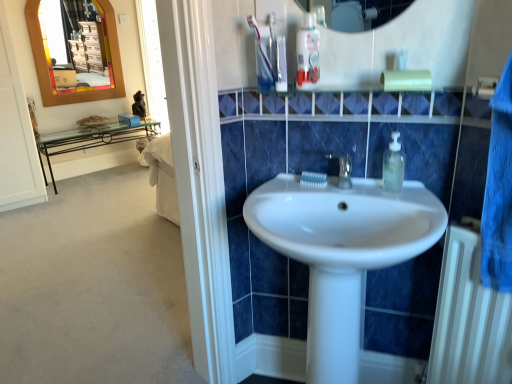
Question: From a real-world perspective, is clear plastic soap dispenser at upper right located beneath white glossy sink at center?

Choices:
 (A) yes
 (B) no

Answer: (B)

Question: Considering the relative sizes of clear plastic soap dispenser at upper right and white glossy sink at center in the image provided, is clear plastic soap dispenser at upper right taller than white glossy sink at center?

Choices:
 (A) no
 (B) yes

Answer: (A)

Question: Is clear plastic soap dispenser at upper right behind white glossy sink at center?

Choices:
 (A) yes
 (B) no

Answer: (A)

Question: Does clear plastic soap dispenser at upper right appear on the right side of white glossy sink at center?

Choices:
 (A) no
 (B) yes

Answer: (B)

Question: Is the surface of clear plastic soap dispenser at upper right in direct contact with white glossy sink at center?

Choices:
 (A) yes
 (B) no

Answer: (B)

Question: In terms of size, does white glossy sink at center appear bigger or smaller than white glossy toothpaste at upper center, which is the first toothpaste in left-to-right order?

Choices:
 (A) small
 (B) big

Answer: (B)

Question: From a real-world perspective, is white glossy sink at center above or below white glossy toothpaste at upper center, which is the 2th toothpaste from bottom to top?

Choices:
 (A) below
 (B) above

Answer: (A)

Question: Would you say white glossy sink at center is inside or outside white glossy toothpaste at upper center, the second toothpaste in the back-to-front sequence?

Choices:
 (A) inside
 (B) outside

Answer: (B)

Question: Is point (318, 205) positioned closer to the camera than point (269, 77)?

Choices:
 (A) closer
 (B) farther

Answer: (B)

Question: From the image's perspective, is white glossy toothpaste at center, which ranks as the 1th toothpaste in bottom-to-top order, located above or below clear plastic soap dispenser at upper right?

Choices:
 (A) above
 (B) below

Answer: (B)

Question: From a real-world perspective, is white glossy toothpaste at center, which ranks as the 1th toothpaste in bottom-to-top order, physically located above or below clear plastic soap dispenser at upper right?

Choices:
 (A) below
 (B) above

Answer: (A)

Question: Does point (325, 180) appear closer or farther from the camera than point (394, 155)?

Choices:
 (A) farther
 (B) closer

Answer: (A)

Question: Relative to clear plastic soap dispenser at upper right, is white glossy toothpaste at center, which ranks as the 1th toothpaste in bottom-to-top order, in front or behind?

Choices:
 (A) behind
 (B) front

Answer: (A)

Question: Considering their positions, is white metallic radiator at lower right located in front of or behind white glossy toothpaste at upper center, placed as the first toothpaste when sorted from front to back?

Choices:
 (A) front
 (B) behind

Answer: (A)

Question: Considering the positions of white metallic radiator at lower right and white glossy toothpaste at upper center, which is the second toothpaste in right-to-left order, in the image, is white metallic radiator at lower right wider or thinner than white glossy toothpaste at upper center, which is the second toothpaste in right-to-left order,?

Choices:
 (A) wide
 (B) thin

Answer: (A)